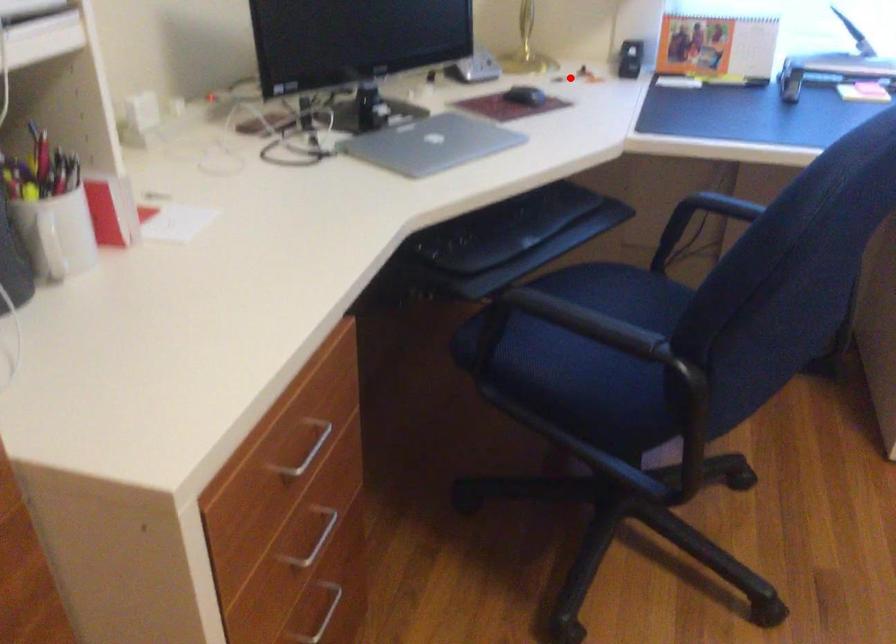
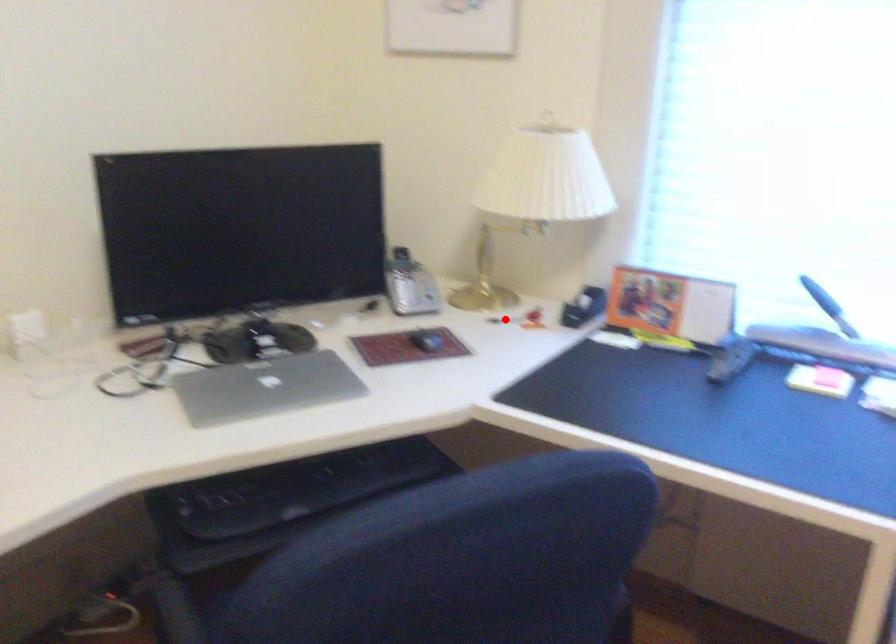
I am providing you with two images of the same scene from different viewpoints. A red point is marked on the first image and another point is marked on the second image. Do the highlighted points in image1 and image2 indicate the same real-world spot?

Yes